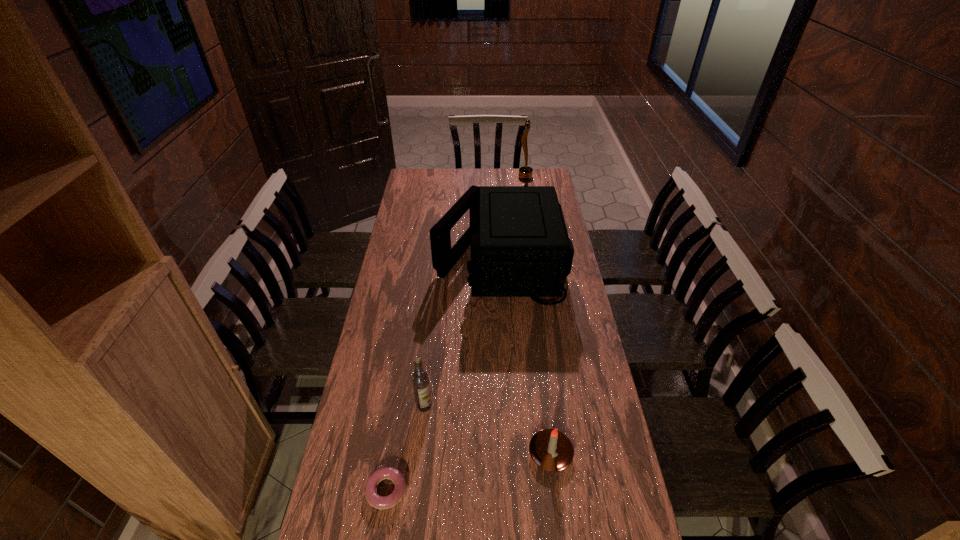
The image size is (960, 540). Find the location of `vacant space that satisfies the following two spatial constraints: 1. with the door open on the fourth nearest object; 2. on the left side of the candle`. vacant space that satisfies the following two spatial constraints: 1. with the door open on the fourth nearest object; 2. on the left side of the candle is located at coordinates (512, 454).

Image resolution: width=960 pixels, height=540 pixels. Identify the location of free space that satisfies the following two spatial constraints: 1. on the front-facing side of the farthest object; 2. on the label of the third shortest object. point(560,406).

Locate an element on the screen. The width and height of the screenshot is (960, 540). vacant region that satisfies the following two spatial constraints: 1. on the label of the third farthest object; 2. on the left side of the candle is located at coordinates (420, 454).